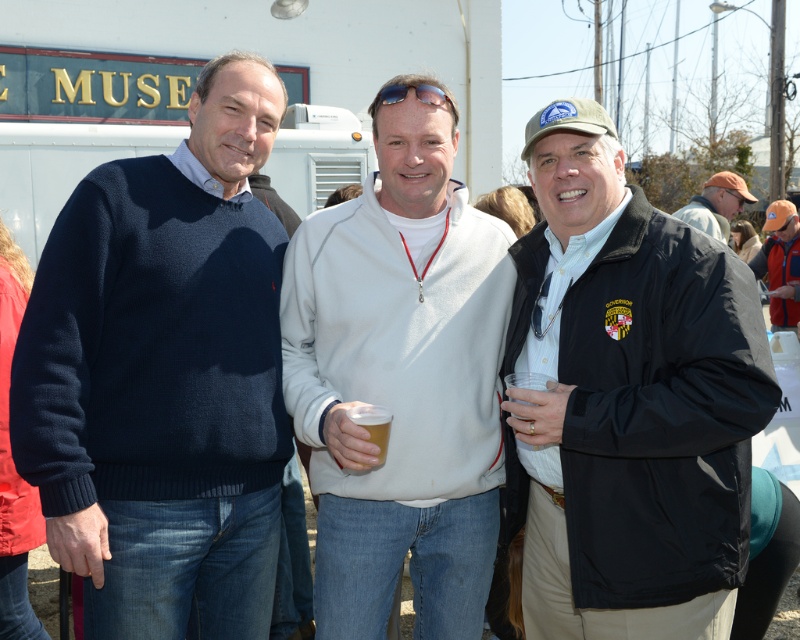
Question: Can you confirm if navy blue sweater at left is positioned above brown cap at upper right?

Choices:
 (A) no
 (B) yes

Answer: (A)

Question: Which object is closer to the camera taking this photo?

Choices:
 (A) brown cap at upper right
 (B) navy blue sweater at left
 (C) black matte jacket at center
 (D) white fleece jacket at center

Answer: (C)

Question: Which point appears farthest from the camera in this image?

Choices:
 (A) (744, 204)
 (B) (384, 440)
 (C) (132, 182)

Answer: (A)

Question: Is navy blue sweater at left closer to the viewer compared to black matte jacket at center?

Choices:
 (A) no
 (B) yes

Answer: (A)

Question: Which object is farther from the camera taking this photo?

Choices:
 (A) white fleece jacket at center
 (B) translucent plastic cup at center

Answer: (A)

Question: Can you confirm if white fleece jacket at center is positioned above brown cap at upper right?

Choices:
 (A) yes
 (B) no

Answer: (B)